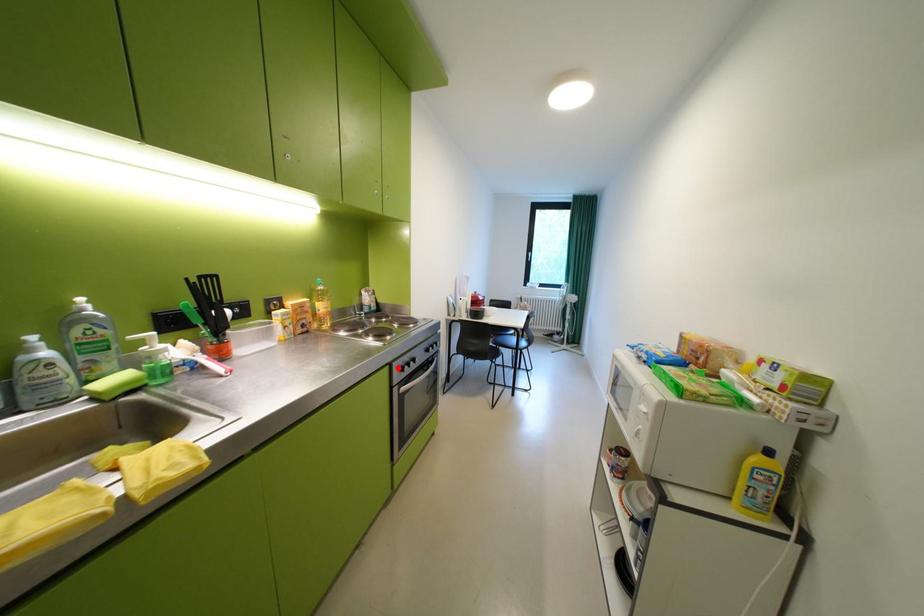
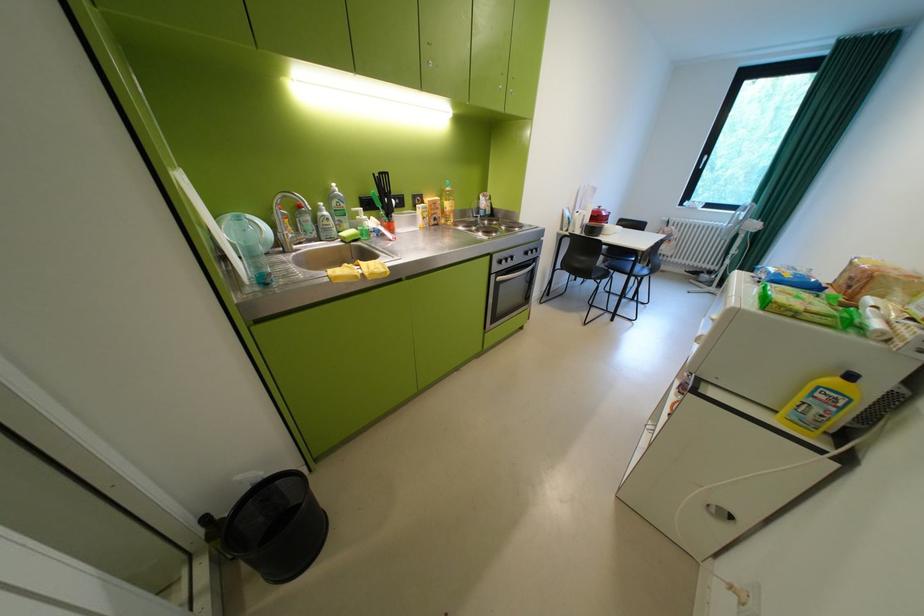
Question: I am providing you with two images of the same scene from different viewpoints. A red point is marked on the first image. Is the red point's position out of view in image 2?

Choices:
 (A) Yes
 (B) No

Answer: (B)